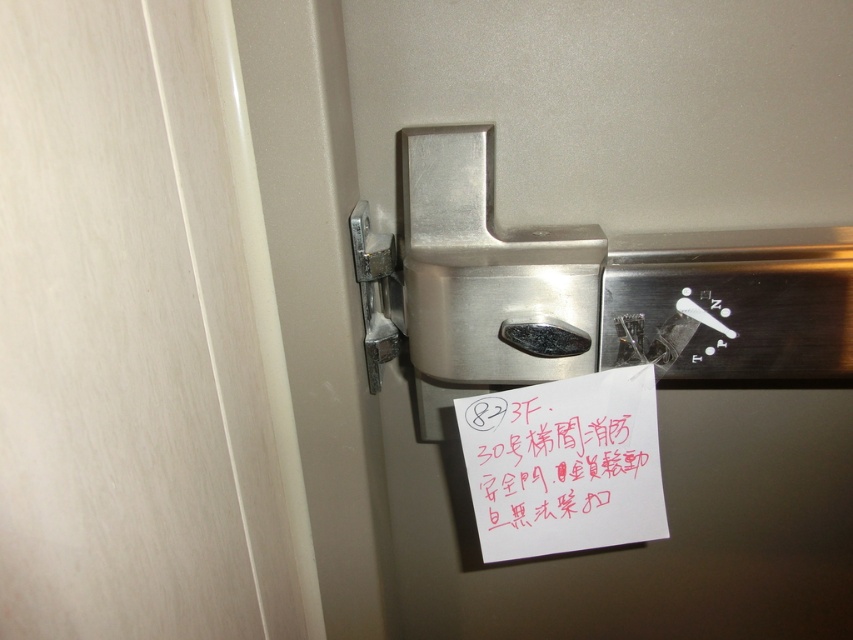
Question: Does satin silver lock at center appear under satin silver hinge at upper right?

Choices:
 (A) yes
 (B) no

Answer: (A)

Question: Which point appears farthest from the camera in this image?

Choices:
 (A) (535, 609)
 (B) (550, 548)
 (C) (395, 282)

Answer: (A)

Question: Can you confirm if white paper at center is wider than satin silver hinge at upper right?

Choices:
 (A) yes
 (B) no

Answer: (A)

Question: Which point is farther to the camera?

Choices:
 (A) satin silver lock at center
 (B) white paper at center
 (C) satin silver hinge at upper right

Answer: (C)

Question: Does satin silver lock at center have a lesser width compared to satin silver hinge at upper right?

Choices:
 (A) no
 (B) yes

Answer: (A)

Question: Among these points, which one is nearest to the camera?

Choices:
 (A) (368, 358)
 (B) (526, 401)
 (C) (575, 180)

Answer: (B)